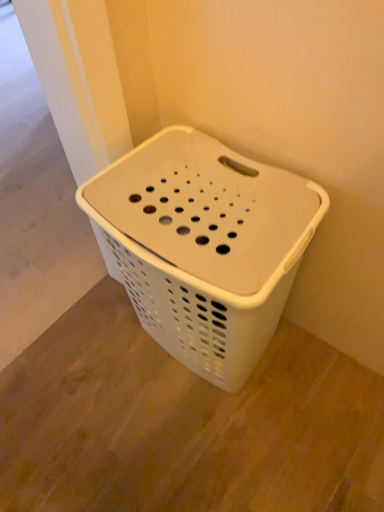
Describe the element at coordinates (205, 246) in the screenshot. This screenshot has height=512, width=384. I see `white plastic laundry basket at center` at that location.

In order to click on white plastic laundry basket at center in this screenshot , I will do `click(205, 246)`.

In order to face white plastic laundry basket at center, should I rotate leftwards or rightwards?

Rotate your view right by about 1.779°.

The width and height of the screenshot is (384, 512). What are the coordinates of `white plastic laundry basket at center` in the screenshot? It's located at (205, 246).